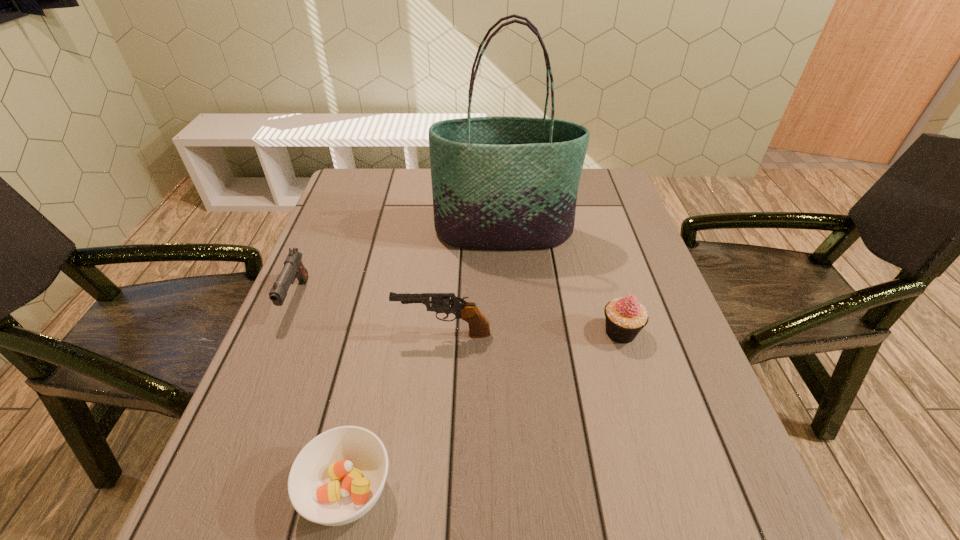
Where is `tote bag`? This screenshot has height=540, width=960. tote bag is located at coordinates (498, 182).

Identify the location of the tallest object. The height and width of the screenshot is (540, 960). (498, 182).

Identify the location of the nearer gun. (479, 327).

Where is `the right gun`? This screenshot has height=540, width=960. the right gun is located at coordinates (479, 327).

The height and width of the screenshot is (540, 960). Find the location of `the rightmost object`. the rightmost object is located at coordinates (625, 317).

Locate an element on the screen. The width and height of the screenshot is (960, 540). the left gun is located at coordinates (293, 268).

Image resolution: width=960 pixels, height=540 pixels. In order to click on the farther gun in this screenshot , I will do `click(293, 268)`.

You are a GUI agent. You are given a task and a screenshot of the screen. Output one action in this format:
    pyautogui.click(x=<x>, y=<y>)
    Task: Click on the vacant area situated 0.080m on the front of the tallest object
    
    Given the screenshot: What is the action you would take?
    pyautogui.click(x=506, y=273)

Identify the location of vacant space located along the barrel of the right gun. (341, 334).

You are a GUI agent. You are given a task and a screenshot of the screen. Output one action in this format:
    pyautogui.click(x=<x>, y=<y>)
    Task: Click on the vacant space located along the barrel of the right gun
    Image resolution: width=960 pixels, height=540 pixels.
    Given the screenshot: What is the action you would take?
    pyautogui.click(x=359, y=334)